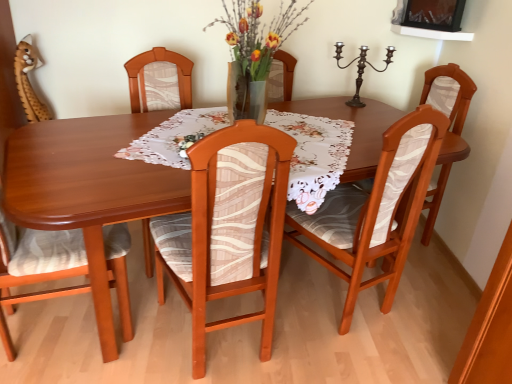
Identify the location of unoccupied region to the right of wooden chair with patterned fabric at center, which ranks as the 3th chair in right-to-left order. (302, 347).